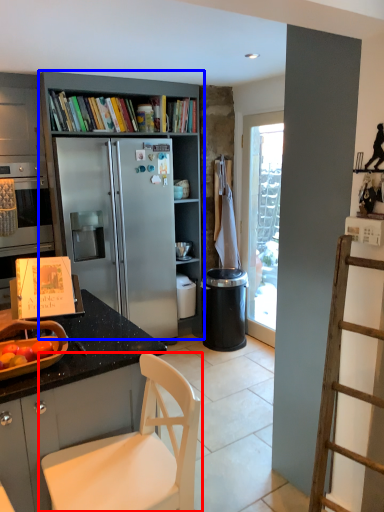
Question: Which of the following is the farthest to the observer, chair (highlighted by a red box) or bookcase (highlighted by a blue box)?

Choices:
 (A) chair
 (B) bookcase

Answer: (B)